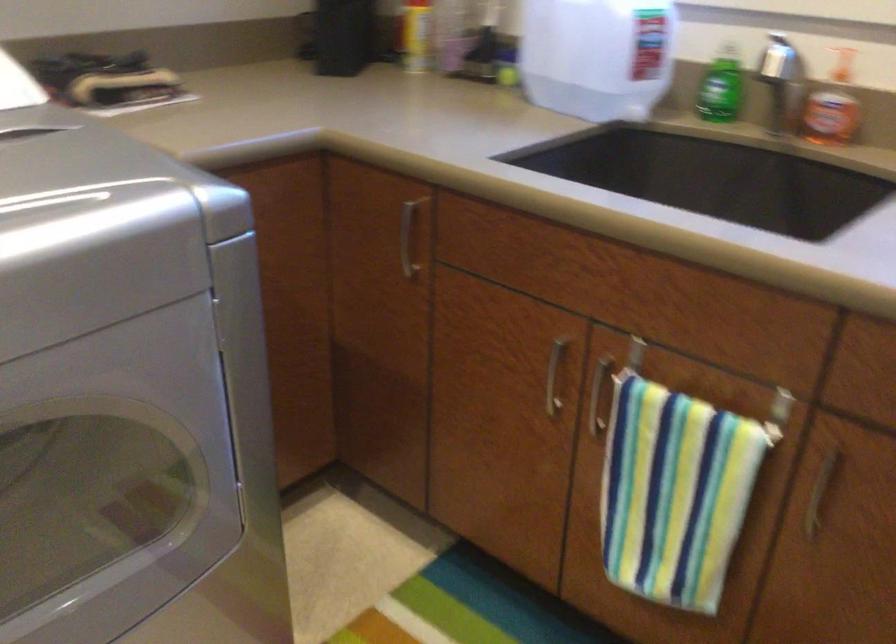
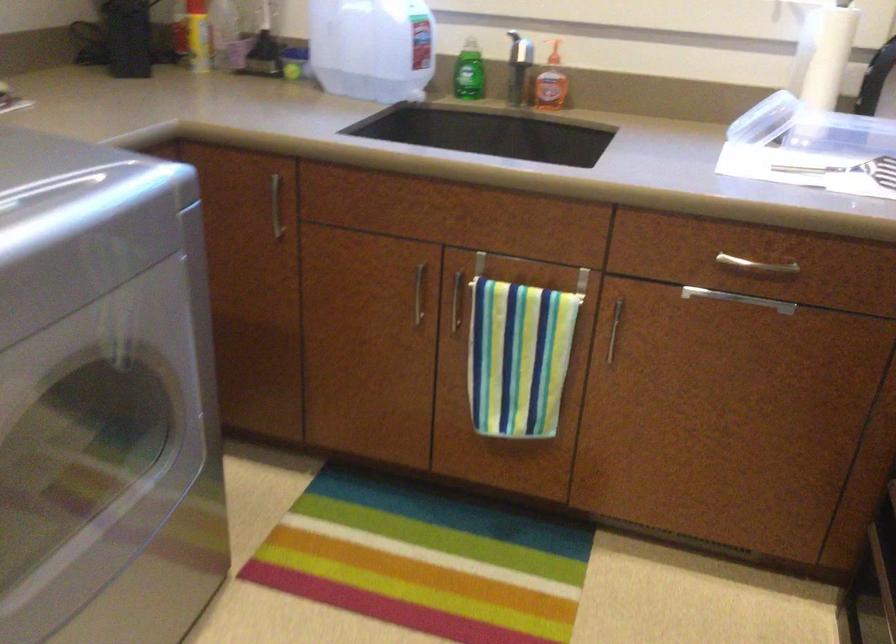
The images are taken continuously from a first-person perspective. In which direction are you moving?

The movement direction of the cameraman is left, backward.